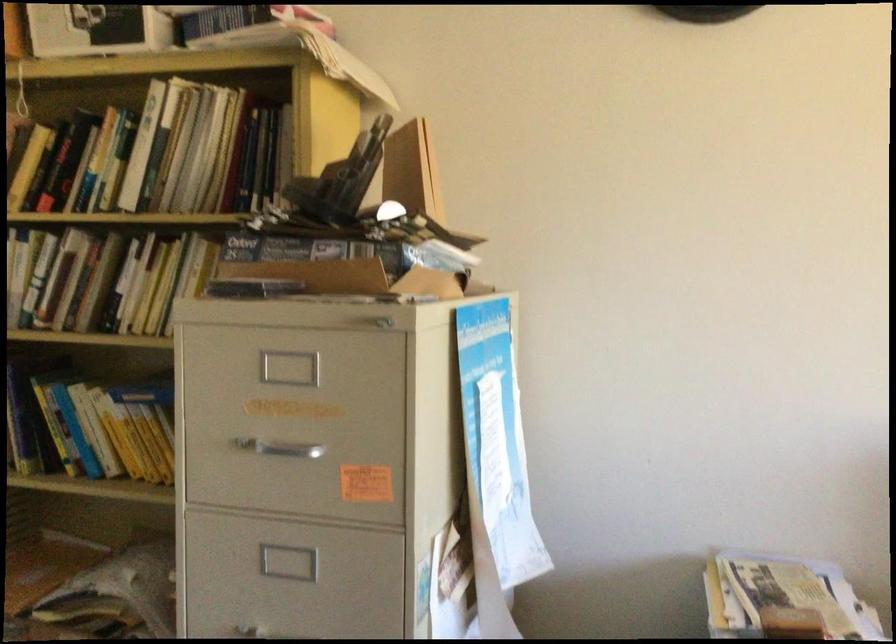
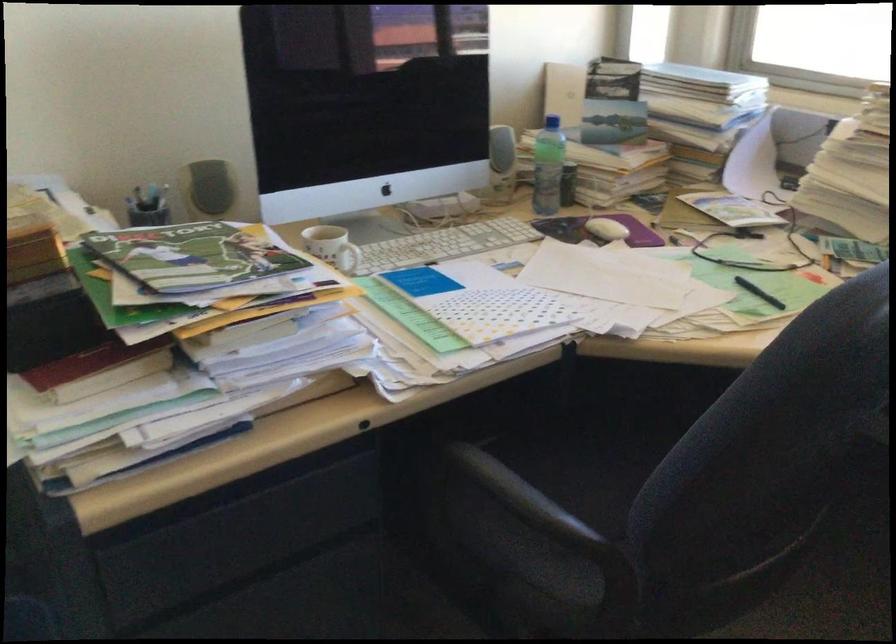
The first image is from the beginning of the video and the second image is from the end. How did the camera likely rotate when shooting the video?

The camera's rotation is toward right-down.